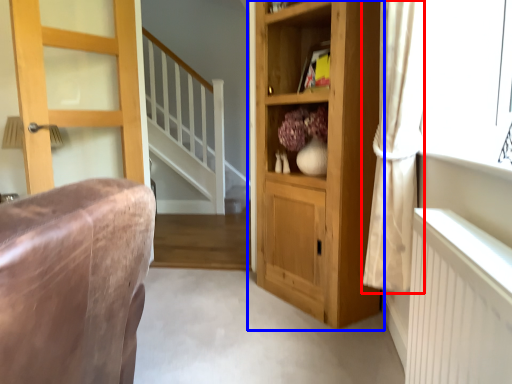
Question: Which object is further to the camera taking this photo, curtain (highlighted by a red box) or cupboard (highlighted by a blue box)?

Choices:
 (A) curtain
 (B) cupboard

Answer: (B)